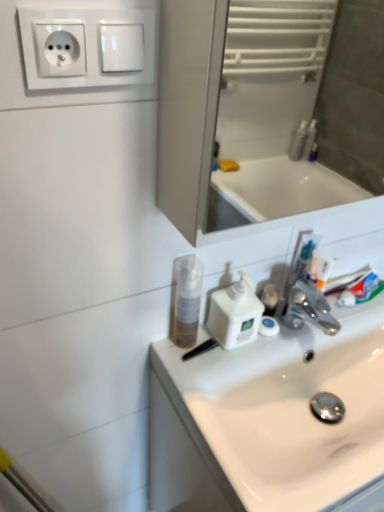
Identify the location of white glossy sink at center. The width and height of the screenshot is (384, 512). (268, 419).

The width and height of the screenshot is (384, 512). Identify the location of translucent plastic mouthwash at sink. (185, 300).

This screenshot has width=384, height=512. What do you see at coordinates (185, 300) in the screenshot? I see `translucent plastic mouthwash at sink` at bounding box center [185, 300].

Image resolution: width=384 pixels, height=512 pixels. What do you see at coordinates (87, 47) in the screenshot?
I see `white plastic socket at upper left` at bounding box center [87, 47].

Locate an element on the screen. white glossy sink at center is located at coordinates (268, 419).

Is white glossy sink at center positioned before white plastic soap dispenser at center?

That is True.

How many degrees apart are the facing directions of white glossy sink at center and white plastic soap dispenser at center?

0.746 degrees separate the facing orientations of white glossy sink at center and white plastic soap dispenser at center.

Is white glossy sink at center beside white plastic soap dispenser at center?

No.

Considering the positions of objects white glossy sink at center and white plastic soap dispenser at center in the image provided, who is more to the left, white glossy sink at center or white plastic soap dispenser at center?

From the viewer's perspective, white plastic soap dispenser at center appears more on the left side.

From a real-world perspective, is white plastic socket at upper left positioned above or below white glossy sink at center?

white plastic socket at upper left is situated higher than white glossy sink at center in the real world.

From the image's perspective, relative to white glossy sink at center, is white plastic socket at upper left above or below?

Based on their image positions, white plastic socket at upper left is located above white glossy sink at center.

Choose the correct answer: Is white plastic socket at upper left inside white glossy sink at center or outside it?

white plastic socket at upper left is spatially situated outside white glossy sink at center.

Is the surface of white plastic socket at upper left in direct contact with white glossy sink at center?

They are not placed beside each other.

From the image's perspective, between white glossy sink at center and white plastic socket at upper left, which one is located above?

From the image's view, white plastic socket at upper left is above.

Which object is more forward, white glossy sink at center or white plastic socket at upper left?

white plastic socket at upper left.

Between white glossy sink at center and white plastic socket at upper left, which one has larger width?

Wider between the two is white glossy sink at center.

Would you say white plastic socket at upper left is part of white glossy sink at center's contents?

No, white plastic socket at upper left is located outside of white glossy sink at center.

From the image's perspective, which object appears higher, white plastic soap dispenser at center or white plastic socket at upper left?

From the image's view, white plastic socket at upper left is above.

Is white plastic soap dispenser at center thinner than white plastic socket at upper left?

In fact, white plastic soap dispenser at center might be wider than white plastic socket at upper left.

Locate an element on the screen. electric outlet on the left of white plastic soap dispenser at center is located at coordinates (87, 47).

Is white plastic soap dispenser at center far from white plastic socket at upper left?

They are positioned close to each other.

Can translucent plastic mouthwash at sink be found inside white glossy sink at center?

No.

Does white glossy sink at center have a smaller size compared to translucent plastic mouthwash at sink?

Incorrect, white glossy sink at center is not smaller in size than translucent plastic mouthwash at sink.

Can you confirm if white glossy sink at center is thinner than translucent plastic mouthwash at sink?

Incorrect, the width of white glossy sink at center is not less than that of translucent plastic mouthwash at sink.

Based on the photo, from their relative heights in the image, would you say white plastic socket at upper left is taller or shorter than translucent plastic mouthwash at sink?

white plastic socket at upper left is shorter than translucent plastic mouthwash at sink.

Is white plastic socket at upper left inside the boundaries of translucent plastic mouthwash at sink, or outside?

white plastic socket at upper left is located beyond the bounds of translucent plastic mouthwash at sink.

Can you see white plastic socket at upper left touching translucent plastic mouthwash at sink?

There is a gap between white plastic socket at upper left and translucent plastic mouthwash at sink.

Is white plastic socket at upper left at the back of translucent plastic mouthwash at sink?

No, white plastic socket at upper left is not at the back of translucent plastic mouthwash at sink.

Consider the image. How different are the orientations of translucent plastic mouthwash at sink and white plastic socket at upper left in degrees?

2.74 degrees separate the facing orientations of translucent plastic mouthwash at sink and white plastic socket at upper left.

Does point (195, 282) come farther from viewer compared to point (92, 67)?

Yes.

Locate an element on the screen. The height and width of the screenshot is (512, 384). sink in front of the white plastic soap dispenser at center is located at coordinates (268, 419).

Locate an element on the screen. sink lying behind the white plastic socket at upper left is located at coordinates (268, 419).

In the scene shown: Based on their spatial positions, is white plastic socket at upper left or white glossy sink at center closer to translucent plastic mouthwash at sink?

white glossy sink at center is closer to translucent plastic mouthwash at sink.

Which object lies nearer to the anchor point white glossy sink at center, translucent plastic mouthwash at sink or white plastic soap dispenser at center?

Among the two, white plastic soap dispenser at center is located nearer to white glossy sink at center.

Estimate the real-world distances between objects in this image. Which object is further from white plastic socket at upper left, white plastic soap dispenser at center or translucent plastic mouthwash at sink?

Based on the image, white plastic soap dispenser at center appears to be further to white plastic socket at upper left.

When comparing their distances from white plastic socket at upper left, does white glossy sink at center or translucent plastic mouthwash at sink seem further?

white glossy sink at center.

Which object lies nearer to the anchor point white plastic socket at upper left, white glossy sink at center or white plastic soap dispenser at center?

white plastic soap dispenser at center is closer to white plastic socket at upper left.

Based on their spatial positions, is white plastic socket at upper left or translucent plastic mouthwash at sink closer to white plastic soap dispenser at center?

translucent plastic mouthwash at sink lies closer to white plastic soap dispenser at center than the other object.

Based on their spatial positions, is white plastic soap dispenser at center or translucent plastic mouthwash at sink closer to white glossy sink at center?

white plastic soap dispenser at center.

When comparing their distances from translucent plastic mouthwash at sink, does white plastic soap dispenser at center or white glossy sink at center seem closer?

white plastic soap dispenser at center lies closer to translucent plastic mouthwash at sink than the other object.

Where is `mouthwash that lies between white plastic socket at upper left and white glossy sink at center from top to bottom`? The image size is (384, 512). mouthwash that lies between white plastic socket at upper left and white glossy sink at center from top to bottom is located at coordinates (185, 300).

Image resolution: width=384 pixels, height=512 pixels. I want to click on mouthwash between white plastic socket at upper left and white plastic soap dispenser at center in the vertical direction, so click(185, 300).

Locate an element on the screen. soap dispenser situated between translucent plastic mouthwash at sink and white glossy sink at center from left to right is located at coordinates (235, 314).

At what (x,y) coordinates should I click in order to perform the action: click on soap dispenser that lies between white plastic socket at upper left and white glossy sink at center from top to bottom. Please return your answer as a coordinate pair (x, y). Looking at the image, I should click on (235, 314).